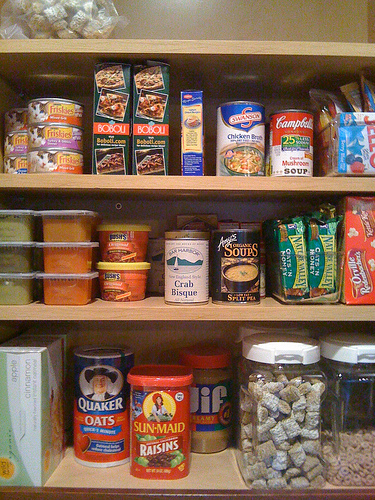
This screenshot has height=500, width=375. What are the coordinates of `5 clear plastic containers` in the screenshot? It's located at (345, 143), (296, 267), (350, 426), (300, 428), (60, 27).